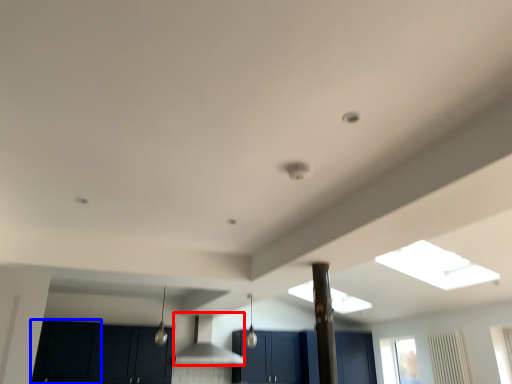
Question: Which object is further to the camera taking this photo, vent (highlighted by a red box) or cabinetry (highlighted by a blue box)?

Choices:
 (A) vent
 (B) cabinetry

Answer: (A)